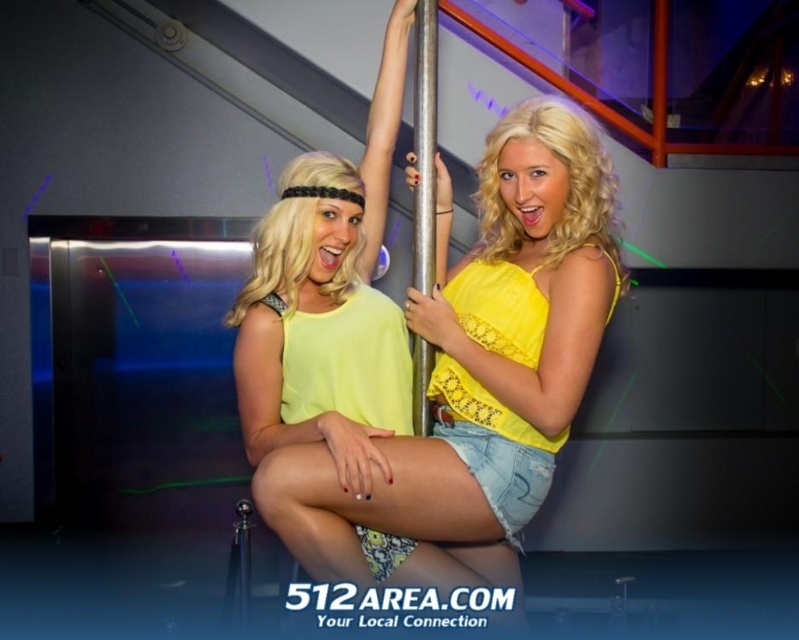
Which is behind, point (317, 468) or point (415, 120)?

Point (415, 120)

At what (x,y) coordinates should I click in order to perform the action: click on yellow denim shorts at center. Please return your answer as a coordinate pair (x, y). Looking at the image, I should click on (476, 372).